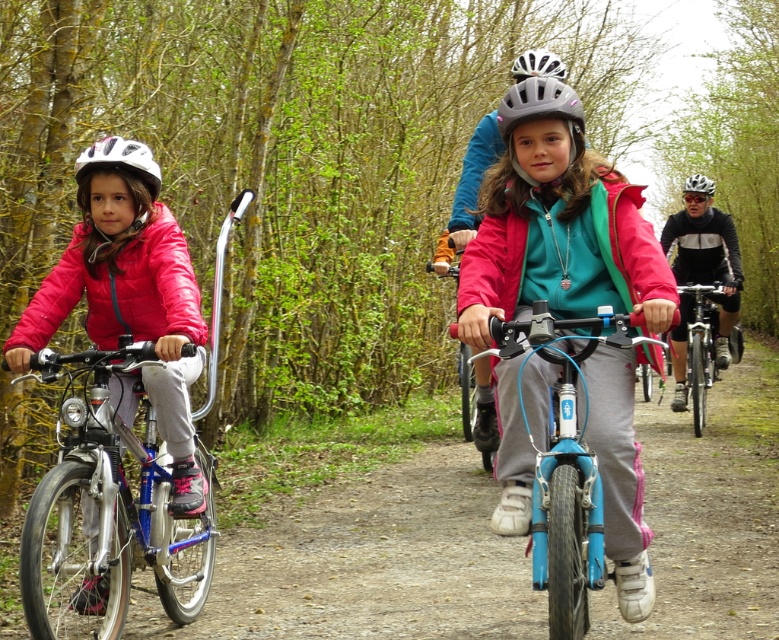
Which is behind, point (607, 522) or point (503, 108)?

Point (503, 108)

Can you confirm if blue matte bicycle at center is bigger than gray matte helmet at center?

Indeed, blue matte bicycle at center has a larger size compared to gray matte helmet at center.

Consider the image. Who is more distant from viewer, (610, 422) or (545, 84)?

The point (545, 84) is more distant.

Where is `blue matte bicycle at center`? blue matte bicycle at center is located at coordinates (573, 419).

Who is higher up, brushed metal bicycle at left or white matte helmet at center?

white matte helmet at center is above.

Describe the element at coordinates (108, 512) in the screenshot. I see `brushed metal bicycle at left` at that location.

The image size is (779, 640). I want to click on brushed metal bicycle at left, so click(x=108, y=512).

Between matte pink jacket at center and matte black helmet at center, which one has less height?

matte pink jacket at center is shorter.

Is matte pink jacket at center taller than matte black helmet at center?

No.

Which is behind, point (469, 289) or point (698, 179)?

The point (698, 179) is behind.

Where is `matte pink jacket at center`? The height and width of the screenshot is (640, 779). matte pink jacket at center is located at coordinates (488, 275).